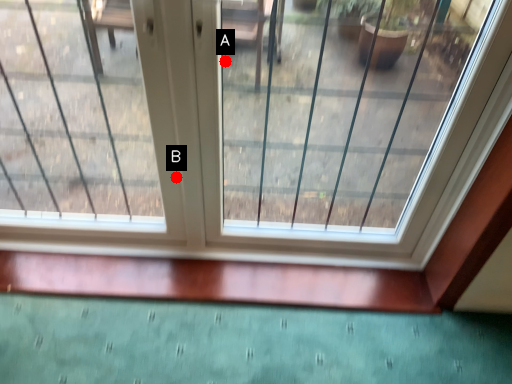
Question: Two points are circled on the image, labeled by A and B beside each circle. Among these points, which one is farthest from the camera?

Choices:
 (A) A is further
 (B) B is further

Answer: (A)